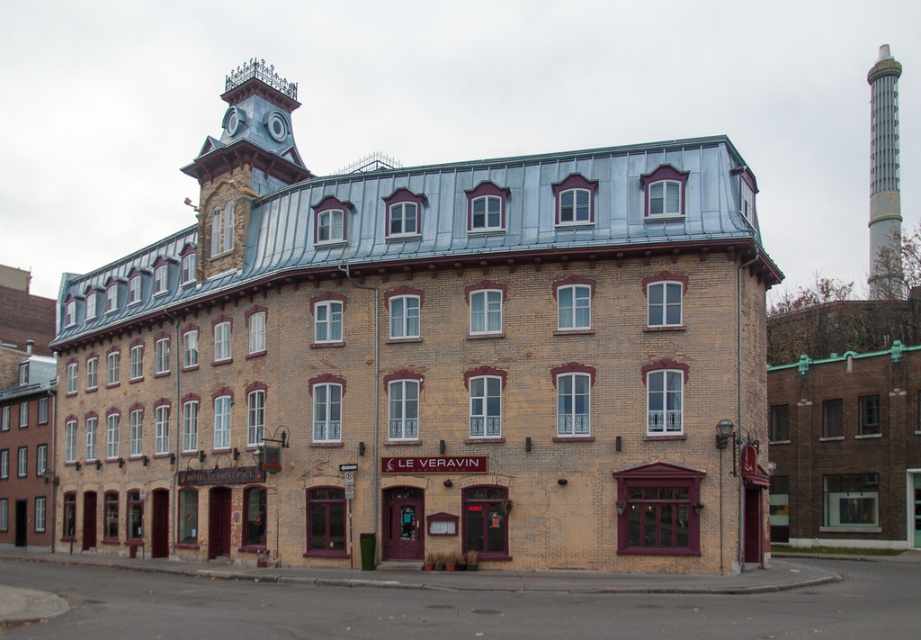
You are standing directly in front of the building and want to locate the blue stone clock tower at upper left. According to the architectural layout, where should you look relative to the building?

The blue stone clock tower at upper left is located at point (243,161), which means it is positioned on the upper left side of the building.

You are an architect assessing the building facade. Which object, the blue stone clock tower at upper left or the silver metallic chimney at upper right, occupies more horizontal space on the building facade?

The silver metallic chimney at upper right occupies more horizontal space on the building facade because it has a greater width than the blue stone clock tower at upper left.

You are standing in front of the building and want to take a photo that includes both the blue stone clock tower at upper left and the silver metallic chimney at upper right. Which object should you position closer to the center of your camera frame to ensure both are in focus?

You should position the blue stone clock tower at upper left closer to the center of your camera frame because it is closer to the viewer than the silver metallic chimney at upper right, ensuring both are in focus.